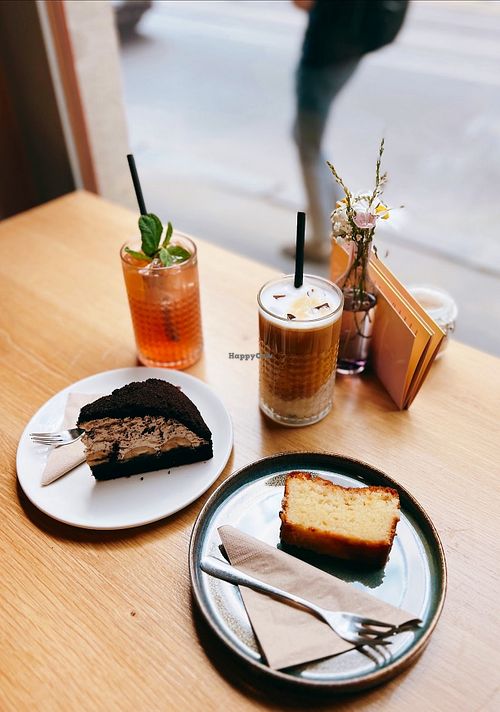
You are a GUI agent. You are given a task and a screenshot of the screen. Output one action in this format:
    pyautogui.click(x=<x>, y=<y>)
    Task: Click on the table
    The width and height of the screenshot is (500, 712).
    Given the screenshot: What is the action you would take?
    pyautogui.click(x=70, y=602)